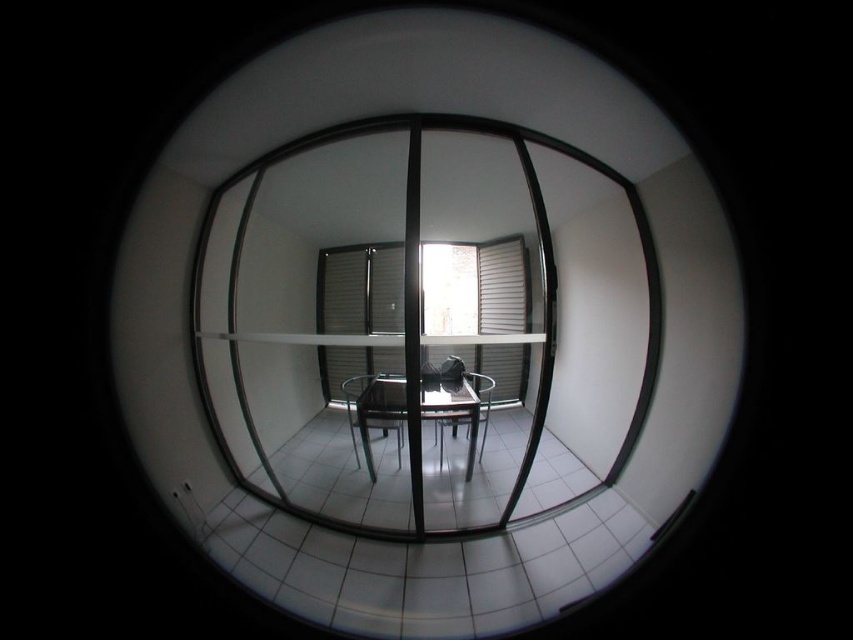
Between point (387, 392) and point (381, 422), which one is positioned behind?

Positioned behind is point (381, 422).

Where is `metallic glass table at center`? metallic glass table at center is located at coordinates (451, 404).

I want to click on metallic glass table at center, so click(x=451, y=404).

Identify the location of metallic glass table at center. Image resolution: width=853 pixels, height=640 pixels. (451, 404).

Who is positioned more to the left, metallic glass table at center or metallic black chair at center?

metallic glass table at center

What do you see at coordinates (451, 404) in the screenshot? The height and width of the screenshot is (640, 853). I see `metallic glass table at center` at bounding box center [451, 404].

I want to click on metallic glass table at center, so click(451, 404).

Which of these two, matte gray window at center or metallic glass table at center, stands shorter?

With less height is metallic glass table at center.

Does matte gray window at center have a greater width compared to metallic glass table at center?

Yes, matte gray window at center is wider than metallic glass table at center.

Who is more forward, (x=469, y=269) or (x=473, y=432)?

Point (x=469, y=269)

In order to click on matte gray window at center in this screenshot , I will do `click(358, 289)`.